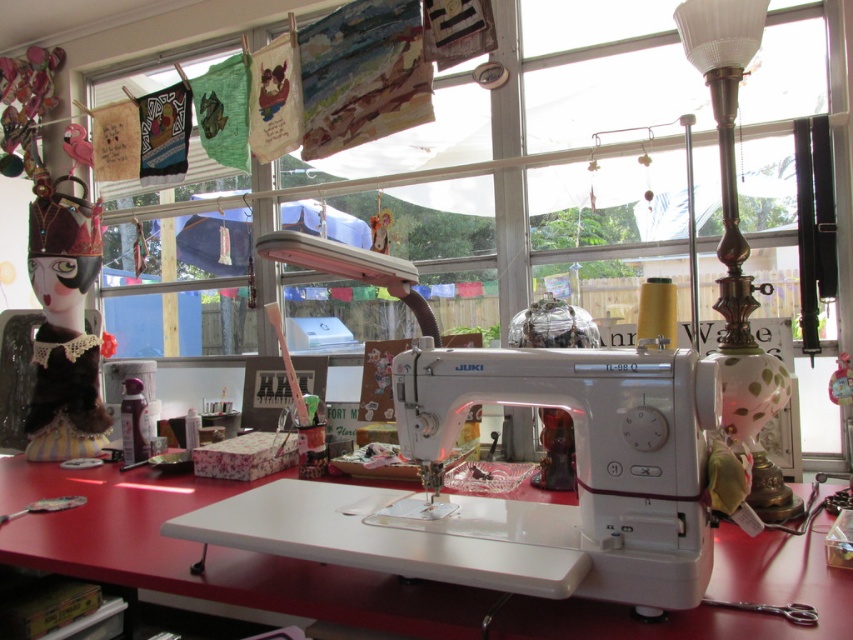
You are a delivery robot that needs to place a small package on the table in the sewing workspace. The package must be placed exactly at point (735, 560). If you are currently 1.5 meters away from the table, will you be able to reach that point on the table without moving closer?

The distance of point (735, 560) from camera is 1.21 meters. Since the robot is currently 1.5 meters away from the table, it is farther than the required point. Therefore, the robot needs to move closer to reach the point.

You are standing at the sewing machine and want to reach a point that is behind another point. Which of the two points, point (451, 157) or point (763, 467), is the one that is behind the other?

Point (451, 157) is behind point (763, 467).

You are a sewing enthusiast who wants to see through the transparent plastic window at center to check the bobbin thread. However, the white plastic sewing machine at center is blocking your view. Can you adjust the sewing machine to access the window?

The transparent plastic window at center is located above the white plastic sewing machine at center, so you can simply look over the sewing machine to see the window without needing to move it.